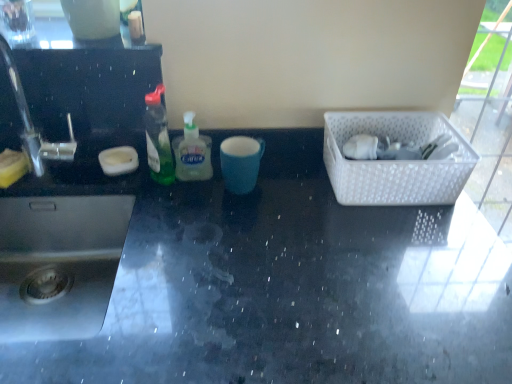
The width and height of the screenshot is (512, 384). In order to click on vacant space to the right of translucent green liquid soap at center, marked as the first bottle in a right-to-left arrangement in this screenshot , I will do point(282,187).